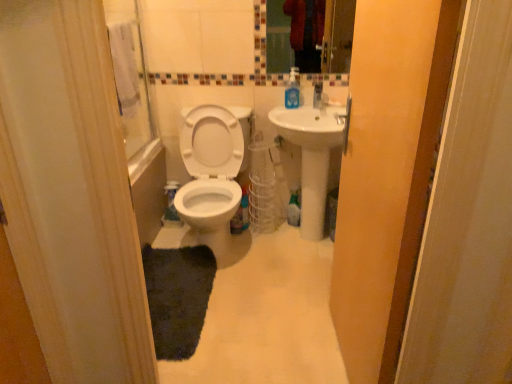
The image size is (512, 384). I want to click on free space above white matte toilet at center (from a real-world perspective), so click(x=243, y=289).